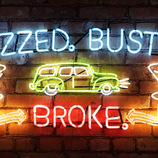
This screenshot has width=158, height=158. In order to click on wall in this screenshot , I will do `click(75, 98)`.